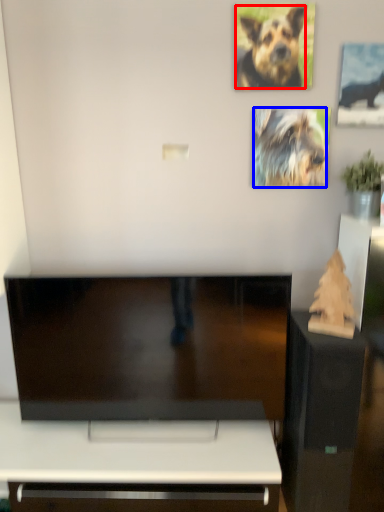
Question: Which object appears farthest to the camera in this image, dog (highlighted by a red box) or dog (highlighted by a blue box)?

Choices:
 (A) dog
 (B) dog

Answer: (B)